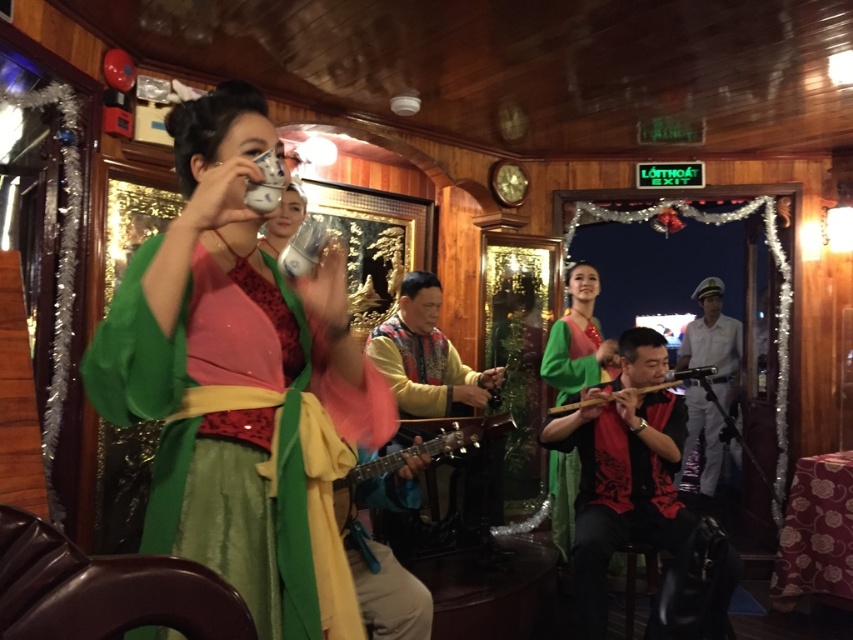
Looking at this image, does green satin dress at center appear over wooden flute at center?

Correct, green satin dress at center is located above wooden flute at center.

This screenshot has height=640, width=853. I want to click on green satin dress at center, so click(578, 339).

In the scene shown: Is red velvet flute at center wider than multicolored fabric guitar at center?

Yes, red velvet flute at center is wider than multicolored fabric guitar at center.

Between red velvet flute at center and multicolored fabric guitar at center, which one is positioned higher?

multicolored fabric guitar at center is higher up.

Find the location of a particular element. This screenshot has width=853, height=640. red velvet flute at center is located at coordinates (622, 472).

Does multicolored fabric guitar at center have a lesser height compared to white uniform at center?

Indeed, multicolored fabric guitar at center has a lesser height compared to white uniform at center.

Is point (422, 294) positioned in front of point (699, 340)?

Yes, it is.

The height and width of the screenshot is (640, 853). What are the coordinates of `multicolored fabric guitar at center` in the screenshot? It's located at point(425,355).